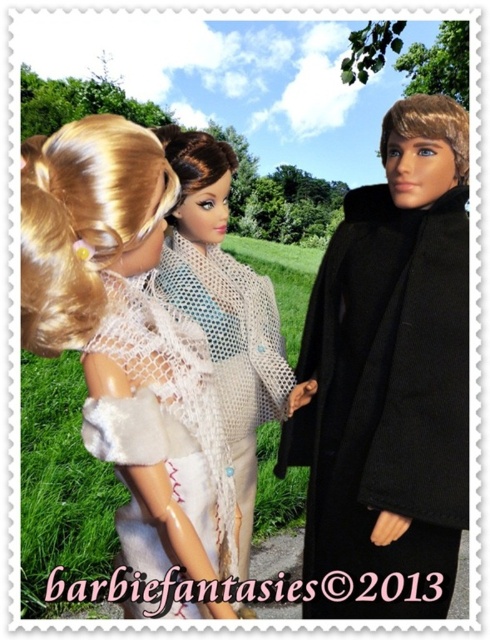
Is white fuzzy coat at upper left positioned before white lace scarf at center?

Yes, white fuzzy coat at upper left is closer to the viewer.

Looking at this image, between white fuzzy coat at upper left and white lace scarf at center, which one is positioned lower?

white lace scarf at center is lower down.

This screenshot has height=640, width=490. What do you see at coordinates (126, 339) in the screenshot?
I see `white fuzzy coat at upper left` at bounding box center [126, 339].

Image resolution: width=490 pixels, height=640 pixels. I want to click on white fuzzy coat at upper left, so click(x=126, y=339).

Is point (436, 344) closer to viewer compared to point (235, 531)?

No, (436, 344) is behind (235, 531).

Is black wool coat at right thinner than white fuzzy coat at upper left?

No.

The height and width of the screenshot is (640, 490). I want to click on black wool coat at right, so click(x=391, y=372).

Where is `black wool coat at right`? Image resolution: width=490 pixels, height=640 pixels. black wool coat at right is located at coordinates (391, 372).

How distant is black wool coat at right from white lace scarf at center?

They are 8.95 inches apart.

Is black wool coat at right in front of white lace scarf at center?

That is True.

What do you see at coordinates (391, 372) in the screenshot? Image resolution: width=490 pixels, height=640 pixels. I see `black wool coat at right` at bounding box center [391, 372].

Locate an element on the screen. black wool coat at right is located at coordinates (391, 372).